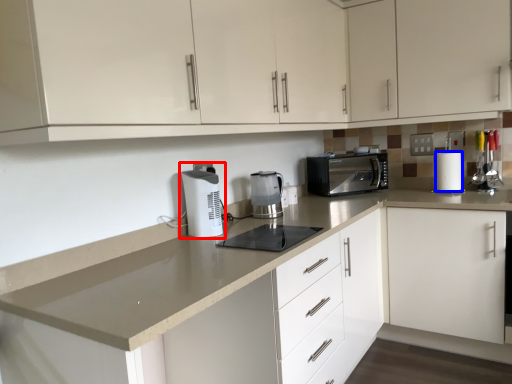
Question: Which object is further to the camera taking this photo, home appliance (highlighted by a red box) or paper towel (highlighted by a blue box)?

Choices:
 (A) home appliance
 (B) paper towel

Answer: (B)